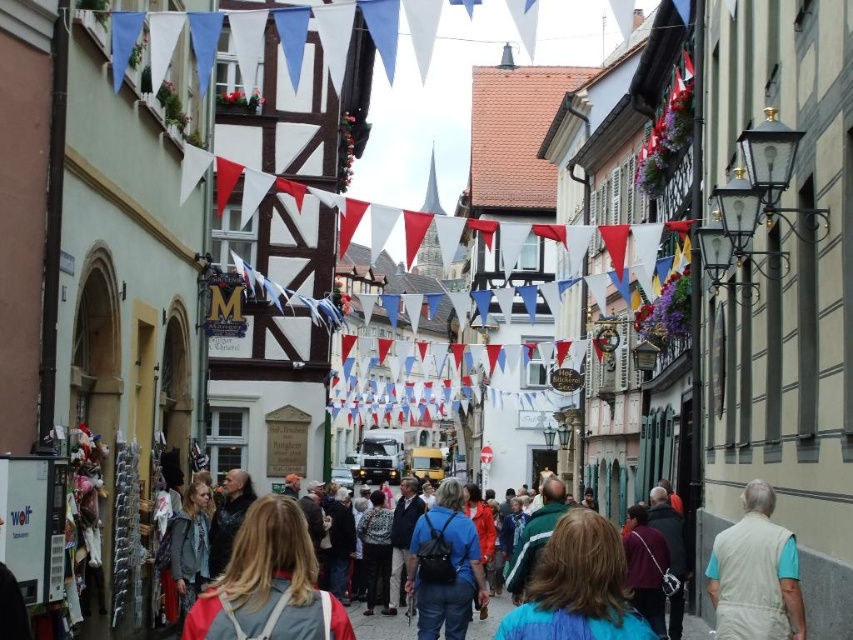
You are a photographer standing in the middle of the street. You notice a denim jacket at lower left and a patterned fabric dress at center. Which item is closer to the camera?

The denim jacket at lower left is closer to the camera because it is positioned over the patterned fabric dress at center.

You are standing at the entrance of the street and want to find the multicolored fabric crowd at center. According to the coordinates provided, in which direction should you look to locate it?

The multicolored fabric crowd at center is located at coordinates point (267, 586). Since the coordinate system is not specified, but typically in such contexts, the x and y coordinates might represent a normalized screen space where (0, 0) is the bottom left corner and (852, 639) is the top right corner. Therefore, 0.916 on the x axis would be far to the right, and 0.314 on the y axis would be about a third of the way up from the bottom. So you should look to your far right and slightly upwards from the bottom to